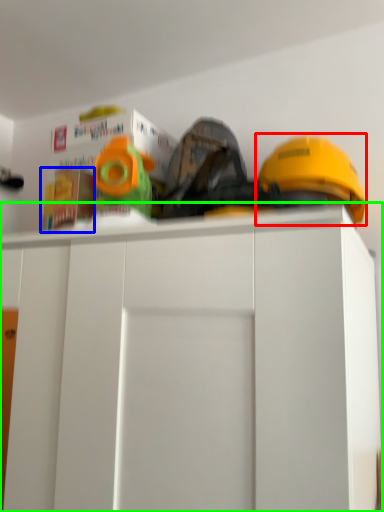
Question: Which object is positioned farthest from helmet (highlighted by a red box)? Select from toy (highlighted by a blue box) and cabinetry (highlighted by a green box).

Choices:
 (A) toy
 (B) cabinetry

Answer: (A)